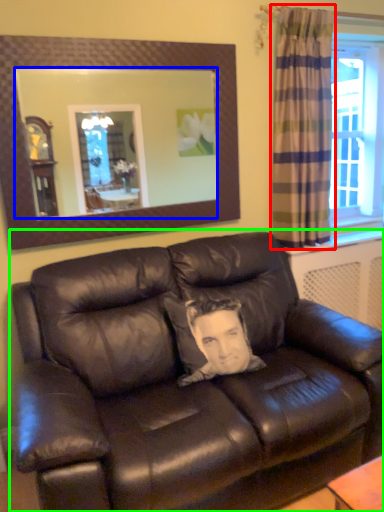
Question: Estimate the real-world distances between objects in this image. Which object is closer to curtain (highlighted by a red box), mirror (highlighted by a blue box) or studio couch (highlighted by a green box)?

Choices:
 (A) mirror
 (B) studio couch

Answer: (B)